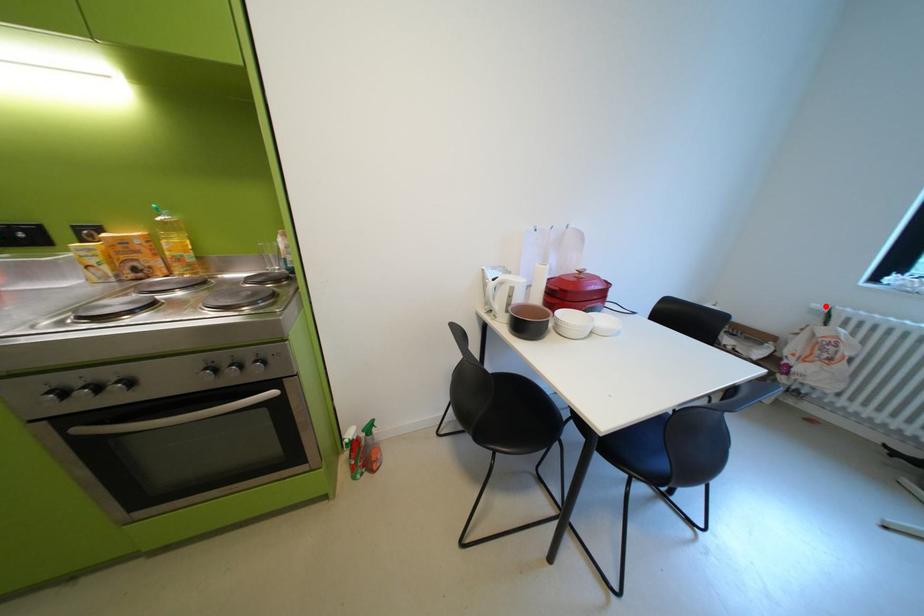
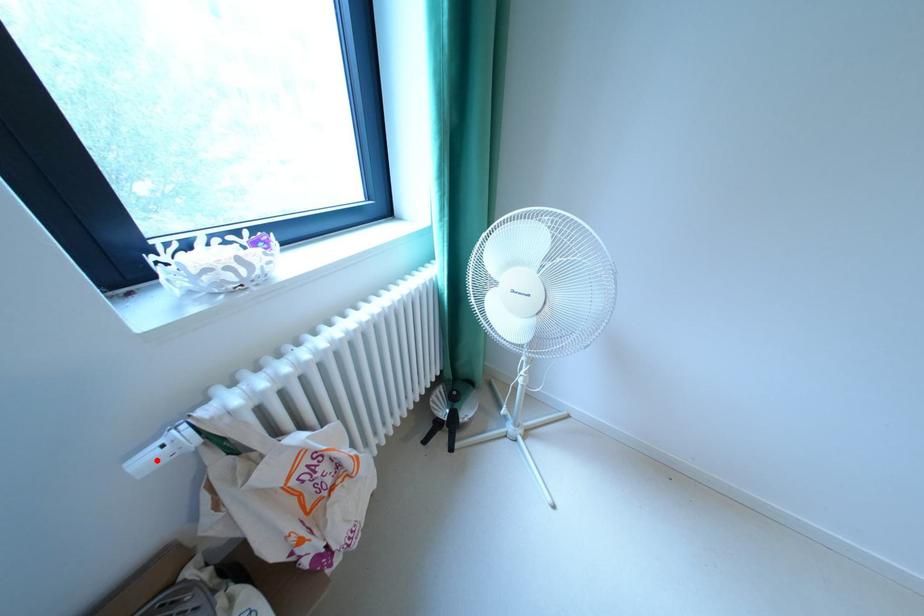
I am providing you with two images of the same scene from different viewpoints. A red point is marked on the first image and another point is marked on the second image. Is the marked point in image1 the same physical position as the marked point in image2?

Yes